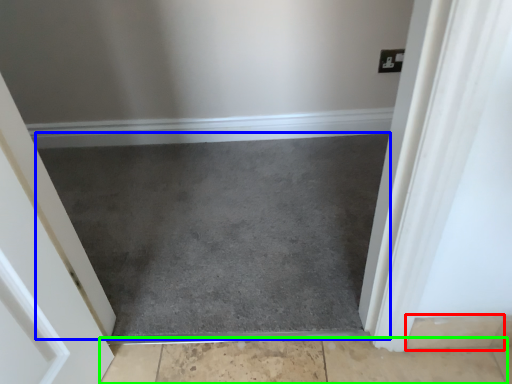
Question: Based on their relative distances, which object is nearer to concrete (highlighted by a red box)? Choose from slate (highlighted by a blue box) and concrete (highlighted by a green box).

Choices:
 (A) slate
 (B) concrete

Answer: (B)